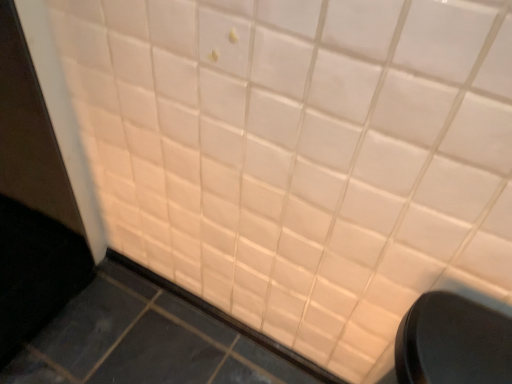
Question: Should I look upward or downward to see black matte trash can at lower right?

Choices:
 (A) up
 (B) down

Answer: (B)